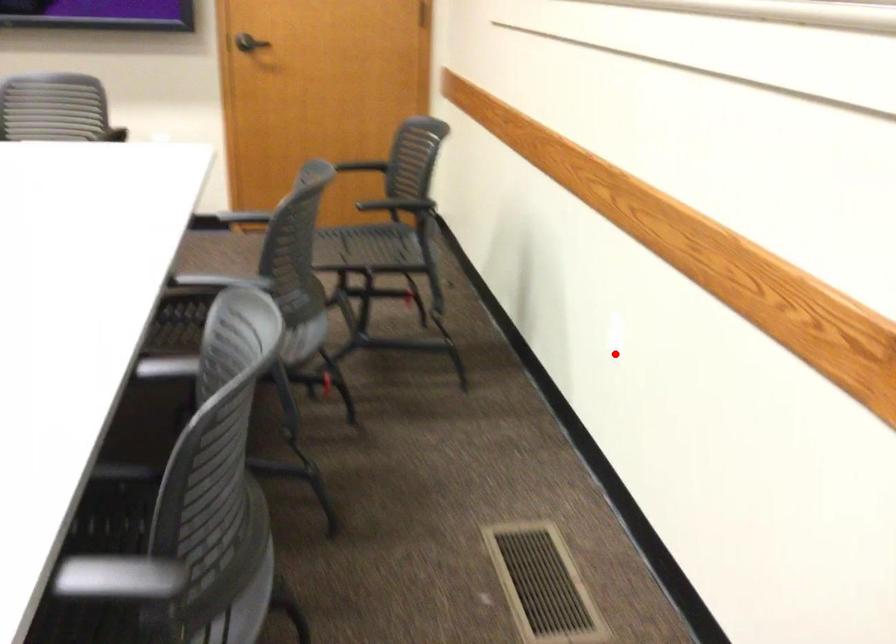
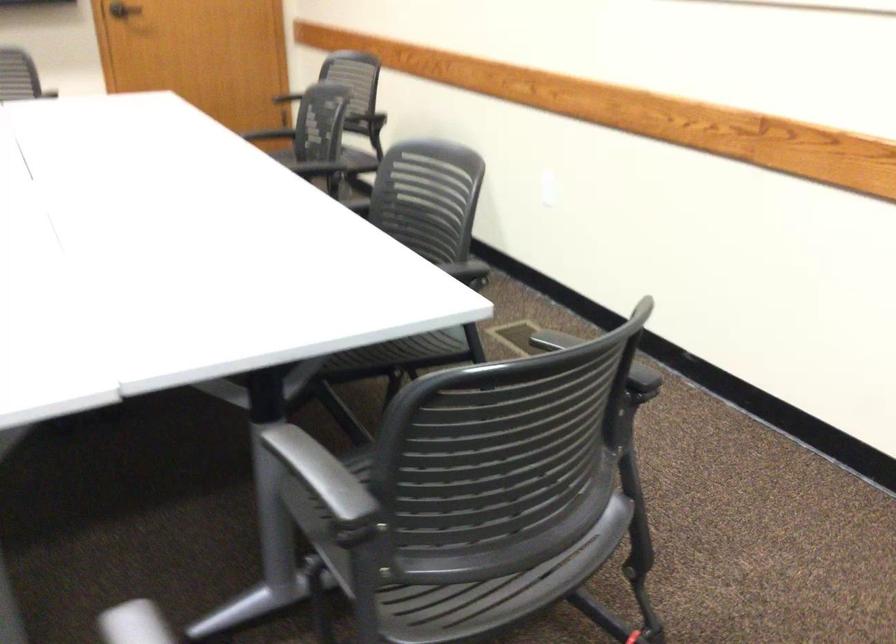
Where in the second image is the point corresponding to the highlighted location from the first image?

(547, 196)